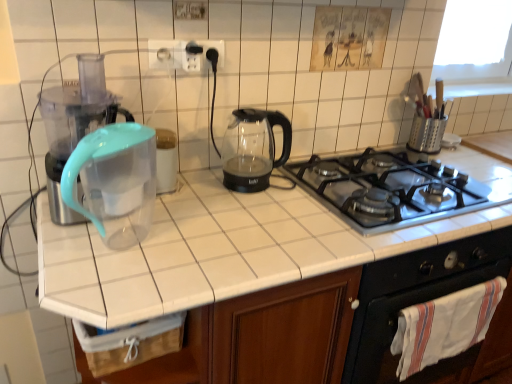
You are a GUI agent. You are given a task and a screenshot of the screen. Output one action in this format:
    pyautogui.click(x=<x>, y=<y>)
    Task: Click on the vacant area on top of transparent plastic pitcher at left (from a real-world perspective)
    This screenshot has height=384, width=512.
    Given the screenshot: What is the action you would take?
    pyautogui.click(x=322, y=196)